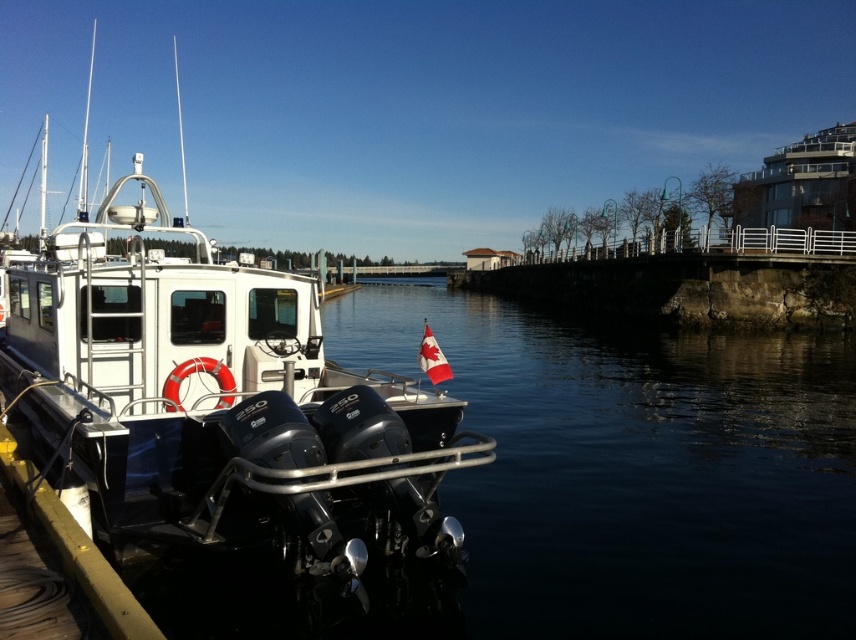
Looking at this image, you are a photographer trying to capture the white glossy boat at left and the dark blue water at lower left in a single frame. Which object will appear narrower in the photo?

The dark blue water at lower left is thinner than the white glossy boat at left, so it will appear narrower in the photo.

You are standing at the origin point of the image coordinate system, which is at the bottom left corner. You want to move to the dark blue water at lower left. Which direction should you go?

Since the dark blue water at lower left is located at coordinate point 0.731 on the x axis and 0.742 on the y axis, you should move to the right and slightly upwards from your current position at the origin point.

You are a photographer planning to capture the white glossy boat at left and the dark blue water at lower left in a single shot. Which of these two elements will take up more space in your photo?

The white glossy boat at left occupies more space than the dark blue water at lower left in the photo.